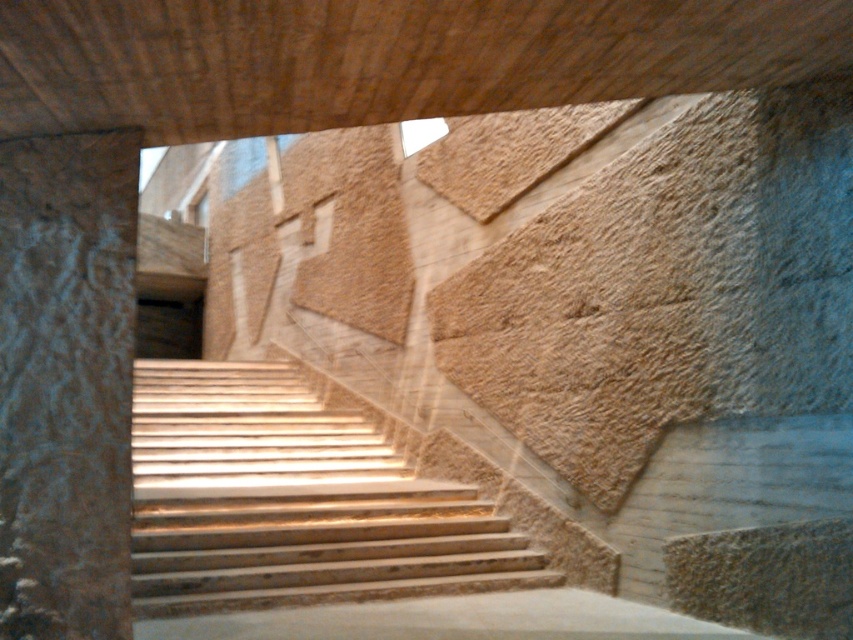
Question: Does light brown wooden stairs at center have a lesser width compared to rough stone pillar at left?

Choices:
 (A) no
 (B) yes

Answer: (A)

Question: Does light brown wooden stairs at center appear on the right side of rough stone pillar at left?

Choices:
 (A) yes
 (B) no

Answer: (A)

Question: Can you confirm if light brown wooden stairs at center is positioned to the right of rough stone pillar at left?

Choices:
 (A) no
 (B) yes

Answer: (B)

Question: Which point appears closest to the camera in this image?

Choices:
 (A) (44, 588)
 (B) (192, 401)

Answer: (A)

Question: Which of the following is the farthest from the observer?

Choices:
 (A) (422, 531)
 (B) (50, 422)

Answer: (A)